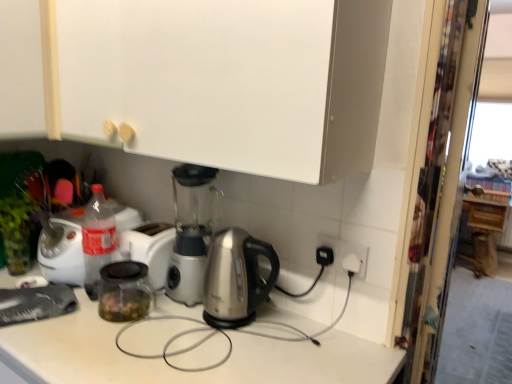
Question: Is satin silver kettle at center next to white matte cabinet at upper left, the 3th cabinetry positioned from the right, and touching it?

Choices:
 (A) no
 (B) yes

Answer: (A)

Question: Is satin silver kettle at center positioned far away from white matte cabinet at upper left, the 3th cabinetry positioned from the right?

Choices:
 (A) no
 (B) yes

Answer: (A)

Question: Does satin silver kettle at center have a greater height compared to white matte cabinet at upper left, the 2th cabinetry viewed from the back?

Choices:
 (A) no
 (B) yes

Answer: (A)

Question: Is satin silver kettle at center positioned behind white matte cabinet at upper left, placed as the first cabinetry when sorted from left to right?

Choices:
 (A) no
 (B) yes

Answer: (A)

Question: From the image's perspective, is satin silver kettle at center below white matte cabinet at upper left, the 2th cabinetry viewed from the back?

Choices:
 (A) yes
 (B) no

Answer: (A)

Question: Does satin silver kettle at center have a lesser height compared to white matte cabinet at upper left, the 2th cabinetry viewed from the back?

Choices:
 (A) yes
 (B) no

Answer: (A)

Question: Can you confirm if white matte cabinet at upper center, the first cabinetry from the front, is positioned to the right of satin silver kettle at center?

Choices:
 (A) no
 (B) yes

Answer: (A)

Question: Can you confirm if white matte cabinet at upper center, the second cabinetry viewed from the right, is positioned to the left of satin silver kettle at center?

Choices:
 (A) no
 (B) yes

Answer: (B)

Question: Is the position of white matte cabinet at upper center, arranged as the second cabinetry when viewed from the left, less distant than that of satin silver kettle at center?

Choices:
 (A) yes
 (B) no

Answer: (B)

Question: From the image's perspective, is white matte cabinet at upper center, arranged as the third cabinetry when viewed from the back, above satin silver kettle at center?

Choices:
 (A) yes
 (B) no

Answer: (A)

Question: Can you confirm if white matte cabinet at upper center, arranged as the third cabinetry when viewed from the back, is thinner than satin silver kettle at center?

Choices:
 (A) yes
 (B) no

Answer: (A)

Question: Is white matte cabinet at upper center, arranged as the second cabinetry when viewed from the left, shorter than satin silver kettle at center?

Choices:
 (A) no
 (B) yes

Answer: (A)

Question: Is the position of white matte cabinet at upper left, the 3th cabinetry positioned from the right, less distant than that of white matte cabinet at upper center, arranged as the second cabinetry when viewed from the left?

Choices:
 (A) yes
 (B) no

Answer: (B)